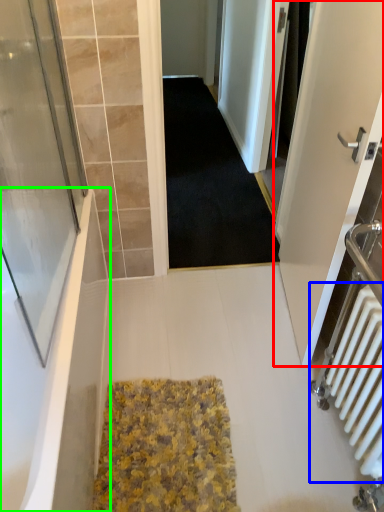
Question: Which object is positioned closest to door (highlighted by a red box)? Select from radiator (highlighted by a blue box) and bathtub (highlighted by a green box).

Choices:
 (A) radiator
 (B) bathtub

Answer: (A)